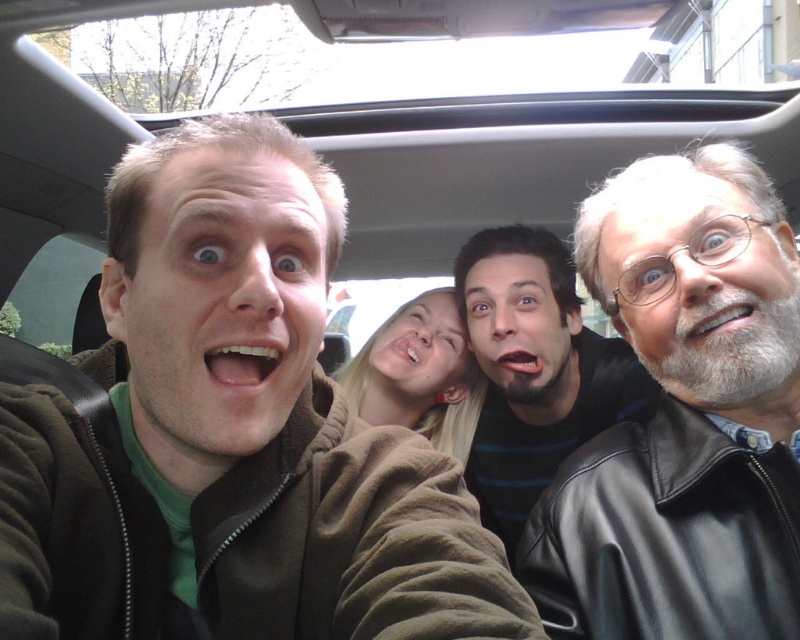
Please look at the image and identify which object the point at coordinates (684,417) is located on. The objects to consider are the black leather jacket at right and the striped shirt second from the right.

The point at coordinates (684,417) is located on the black leather jacket at right.

You are trying to locate the black leather jacket at right in the car. Based on the coordinates provided, where would you find it?

The black leather jacket at right is located at the coordinates point (684, 417).